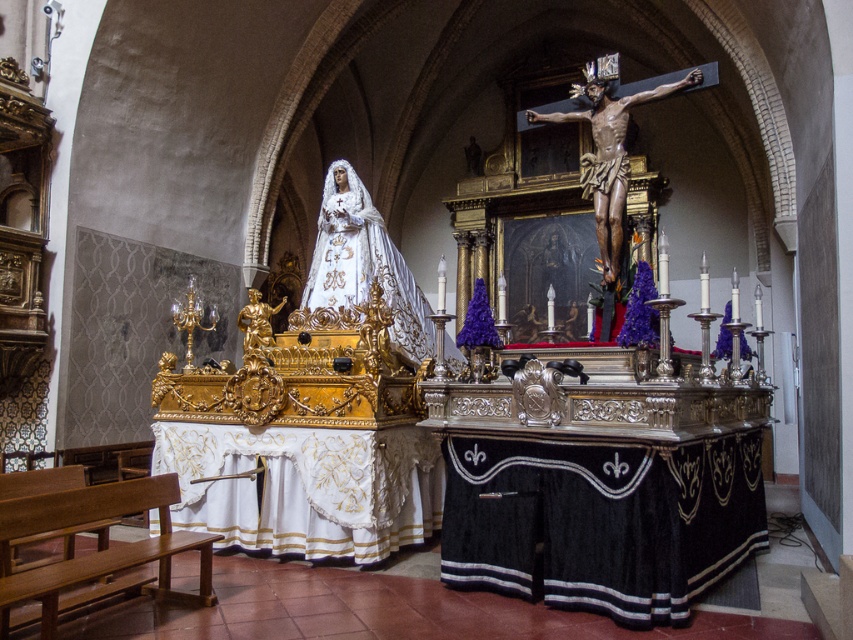
Locate an element on the screen. wooden bench at lower left is located at coordinates (99, 550).

Is point (97, 518) in front of point (607, 90)?

Yes, it is in front of point (607, 90).

Who is more distant from viewer, (73, 563) or (587, 84)?

Point (587, 84)

Image resolution: width=853 pixels, height=640 pixels. I want to click on wooden bench at lower left, so click(99, 550).

Can you confirm if wooden bench at lower left is positioned to the left of white satin statue at center?

Yes, wooden bench at lower left is to the left of white satin statue at center.

Which is more to the right, wooden bench at lower left or white satin statue at center?

white satin statue at center

Is point (64, 522) farther from viewer compared to point (329, 264)?

That is False.

The image size is (853, 640). In order to click on wooden bench at lower left in this screenshot , I will do `click(99, 550)`.

Can you confirm if white satin statue at center is positioned to the left of polished bronze crucifix at center?

Yes, white satin statue at center is to the left of polished bronze crucifix at center.

Which is behind, point (325, 250) or point (612, 104)?

The point (325, 250) is more distant.

The image size is (853, 640). Find the location of `white satin statue at center`. white satin statue at center is located at coordinates (364, 264).